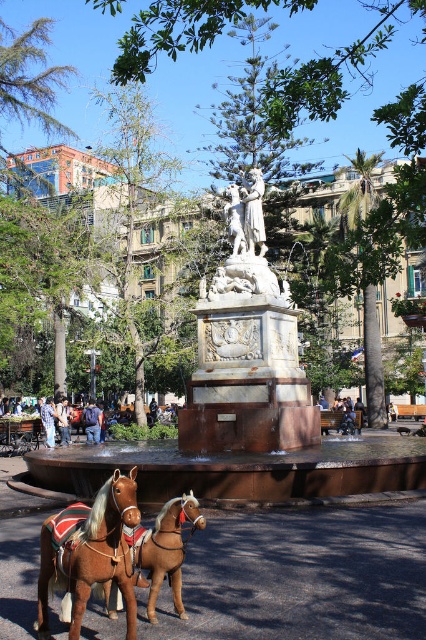
Looking at this image, you are standing at the point with coordinates (x=242, y=417) in the image. What object are you standing on?

You are standing on the white marble fountain at center as the coordinates point to it.

You are a photographer standing in the park and want to take a photo of the brown leather horse at lower left and the blue fabric backpack at center. Which object should you focus on first if you want to capture both in the same frame without moving your camera?

The brown leather horse at lower left is not as tall as the blue fabric backpack at center, so you should focus on the blue fabric backpack at center first to ensure both are in the frame.

You are standing in the park and want to take a photo of the fountain. The camera you are using has a maximum focus distance of 20 meters. Can you focus on the point at coordinates point (42,600) without moving closer?

The point at coordinates point (42,600) is 19.89 meters from the camera, which is within the maximum focus distance of 20 meters. Therefore, you can focus on the point without moving closer.